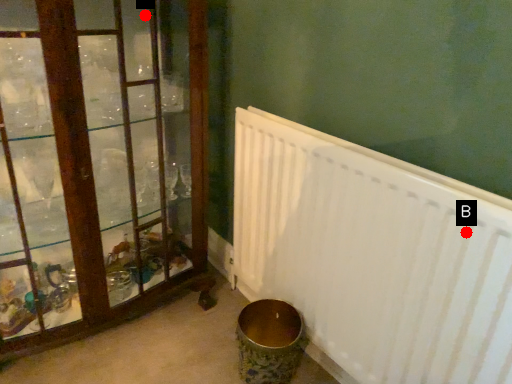
Question: Two points are circled on the image, labeled by A and B beside each circle. Which point appears closest to the camera in this image?

Choices:
 (A) A is closer
 (B) B is closer

Answer: (B)